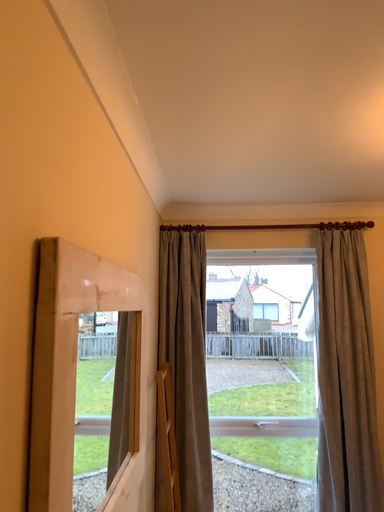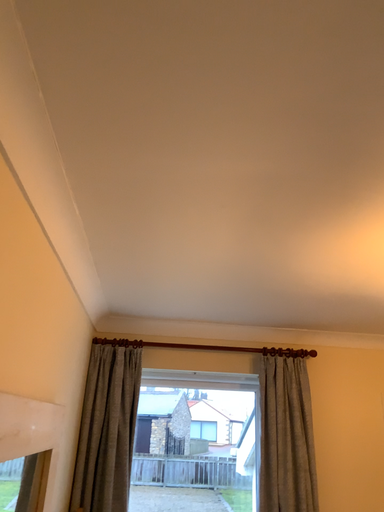
Question: How did the camera likely rotate when shooting the video?

Choices:
 (A) rotated upward
 (B) rotated downward

Answer: (A)